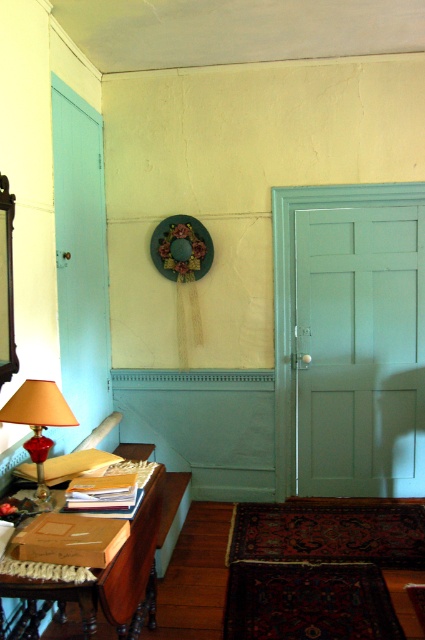
You are standing in the room and want to reach the point marked at coordinates (x=419, y=214). If you can walk 5 meters before needing to rest, will you be able to reach it without stopping?

The distance between you and the point marked at coordinates (x=419, y=214) is 4.19 meters. Since you can walk 5 meters before resting, you can reach it without stopping.

You are standing in the room and want to exit through the matte white door at right. However, there is a green fabric wreath at upper center hanging on the wall. Can you pass through the door without touching the wreath?

The matte white door at right is larger than the green fabric wreath at upper center, so yes, you can pass through the door without touching the wreath as there is enough space.